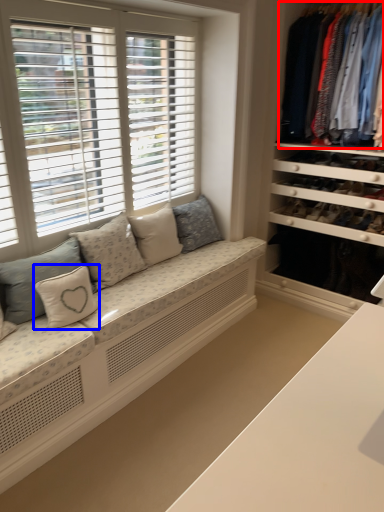
Question: Among these objects, which one is nearest to the camera, clothing (highlighted by a red box) or pillow (highlighted by a blue box)?

Choices:
 (A) clothing
 (B) pillow

Answer: (B)